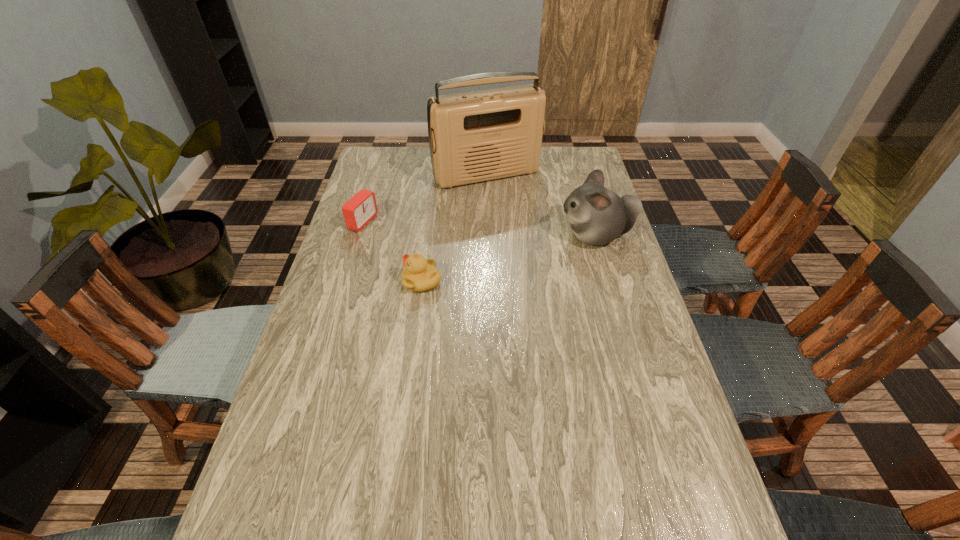
Where is `object present at the right edge`? The height and width of the screenshot is (540, 960). object present at the right edge is located at coordinates (597, 215).

The width and height of the screenshot is (960, 540). Identify the location of vacant space at the far edge of the desktop. (546, 166).

In the image, there is a desktop. What are the coordinates of `free space at the near edge` in the screenshot? It's located at (348, 501).

Find the location of a particular element. The height and width of the screenshot is (540, 960). vacant space at the left edge of the desktop is located at coordinates (282, 443).

Locate an element on the screen. The width and height of the screenshot is (960, 540). free space at the right edge of the desktop is located at coordinates (618, 330).

Where is `vacant area at the far right corner of the desktop`? vacant area at the far right corner of the desktop is located at coordinates (587, 163).

This screenshot has height=540, width=960. Identify the location of vacant area that lies between the tallest object and the rightmost object. (541, 205).

At what (x,y) coordinates should I click in order to perform the action: click on free point between the rightmost object and the nearest object. Please return your answer as a coordinate pair (x, y). The image size is (960, 540). Looking at the image, I should click on (509, 259).

The height and width of the screenshot is (540, 960). I want to click on free spot between the rightmost object and the duckling, so click(x=509, y=259).

The width and height of the screenshot is (960, 540). Find the location of `free space that is in between the nearest object and the leftmost object`. free space that is in between the nearest object and the leftmost object is located at coordinates (393, 252).